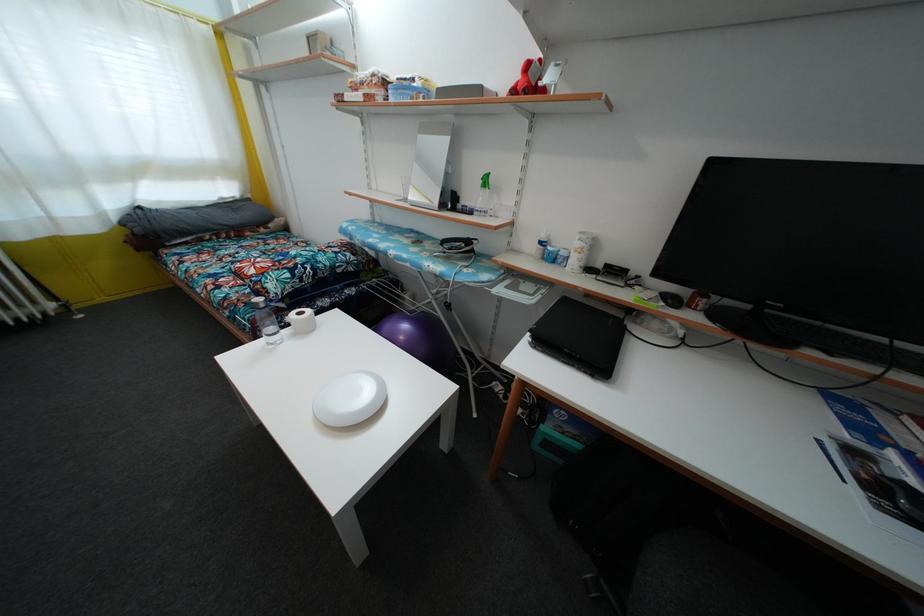
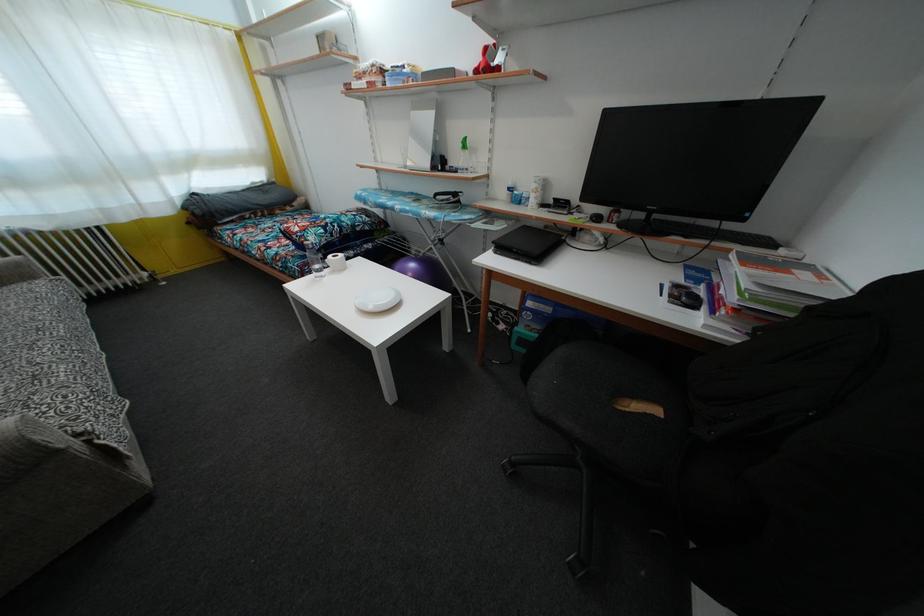
The point at (531, 74) is marked in the first image. Where is the corresponding point in the second image?

(490, 58)